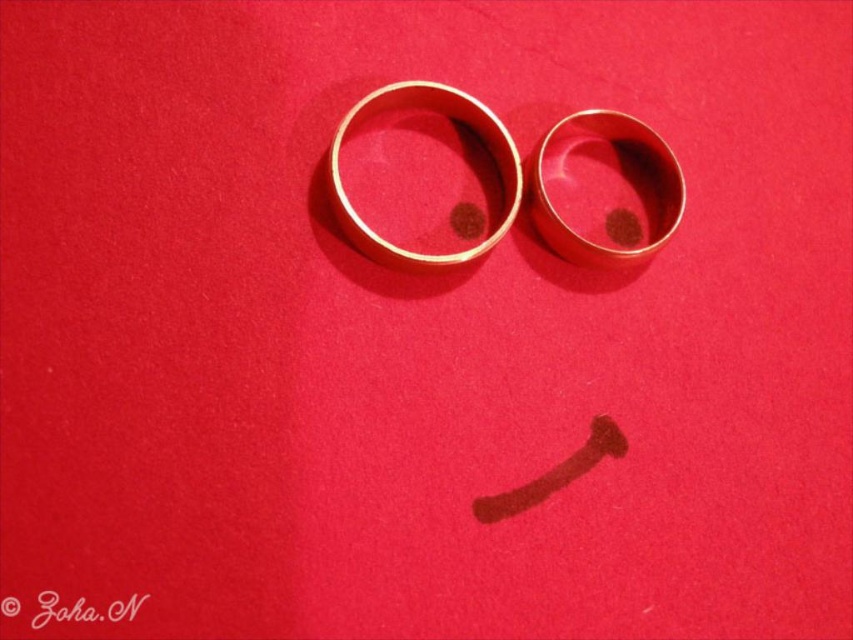
In the scene shown: Does gold polished ring at upper right appear over gold polished ring at center?

No, gold polished ring at upper right is not above gold polished ring at center.

Is the position of gold polished ring at upper right less distant than that of gold polished ring at center?

No.

Between point (625, 157) and point (361, 250), which one is positioned behind?

Positioned behind is point (625, 157).

Identify the location of gold polished ring at upper right. pyautogui.click(x=619, y=177).